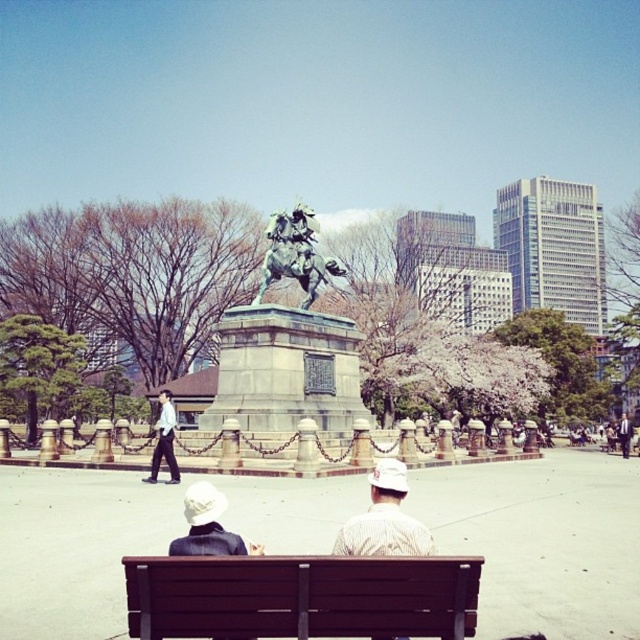
Between brown wooden bench at lower center and light brown leather jacket at center, which one appears on the left side from the viewer's perspective?

Positioned to the left is brown wooden bench at lower center.

Is point (417, 557) positioned after point (620, 420)?

That is False.

Find the location of a particular element. brown wooden bench at lower center is located at coordinates (301, 596).

How distant is polished bronze statue at center from white shirt at center?

They are 71.35 feet apart.

Does point (337, 289) come closer to viewer compared to point (170, 452)?

That is False.

This screenshot has width=640, height=640. What are the coordinates of `polished bronze statue at center` in the screenshot? It's located at (296, 253).

Does light brown fabric shirt at center have a smaller size compared to light brown leather jacket at center?

Yes.

Does point (369, 532) lie behind point (627, 451)?

No, (369, 532) is in front of (627, 451).

Who is more forward, (368, 528) or (624, 449)?

Point (368, 528)

In order to click on light brown fabric shirt at center in this screenshot , I will do `click(385, 518)`.